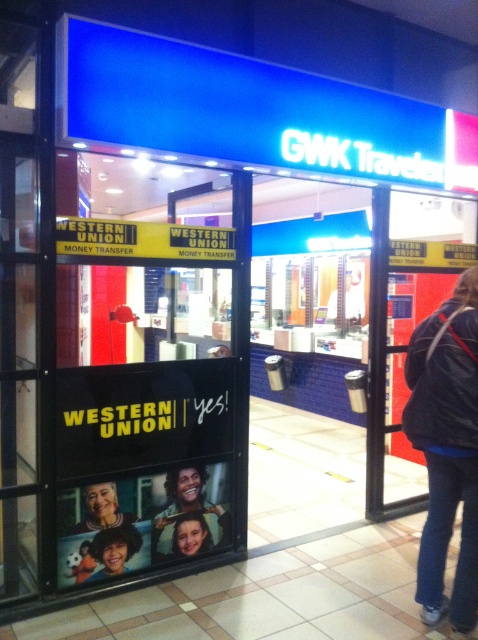
Is point (30, 451) closer to viewer compared to point (184, 548)?

Yes, point (30, 451) is in front of point (184, 548).

The height and width of the screenshot is (640, 478). I want to click on transparent glass door at left, so click(x=18, y=364).

Identify the location of transparent glass door at left. The width and height of the screenshot is (478, 640). click(18, 364).

Is black leather jacket at lower right taller than yellow/black sign at upper center?

Yes, black leather jacket at lower right is taller than yellow/black sign at upper center.

Between black leather jacket at lower right and yellow/black sign at upper center, which one appears on the right side from the viewer's perspective?

From the viewer's perspective, black leather jacket at lower right appears more on the right side.

Is point (465, 540) more distant than point (62, 241)?

That is False.

Where is `black leather jacket at lower right`? black leather jacket at lower right is located at coordinates (446, 448).

Does curly-haired boy at lower left lie behind smooth skin face at lower left?

Yes.

You are a GUI agent. You are given a task and a screenshot of the screen. Output one action in this format:
    pyautogui.click(x=<x>, y=<y>)
    Task: Click on the curly-haired boy at lower left
    This screenshot has width=478, height=640.
    Given the screenshot: What is the action you would take?
    pyautogui.click(x=113, y=548)